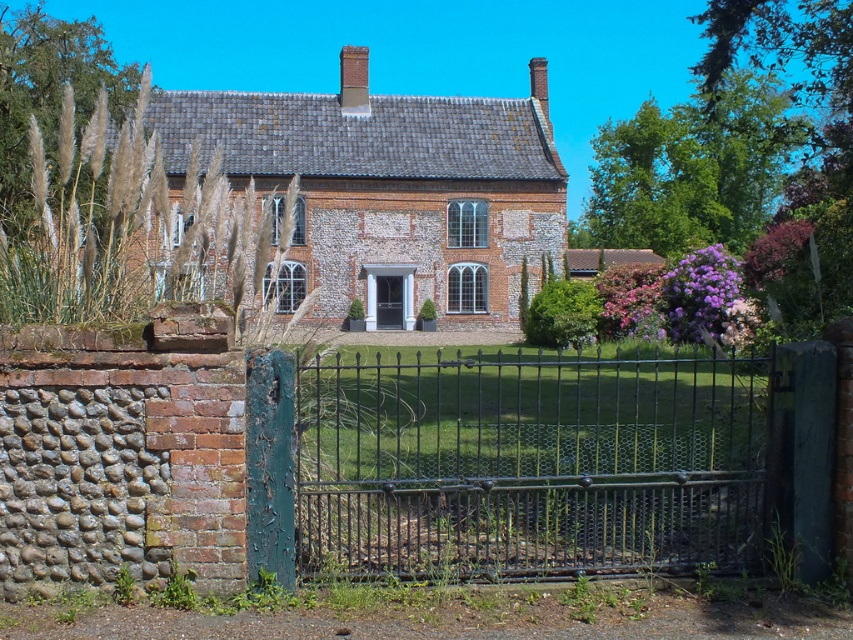
Is point (457, 392) farther from viewer compared to point (381, 324)?

That is False.

Does black wrought iron gate at center lie behind black glass door at center?

No, black wrought iron gate at center is in front of black glass door at center.

Does point (727, 561) come closer to viewer compared to point (398, 276)?

Yes, point (727, 561) is in front of point (398, 276).

Where is `black wrought iron gate at center`? The image size is (853, 640). black wrought iron gate at center is located at coordinates (529, 464).